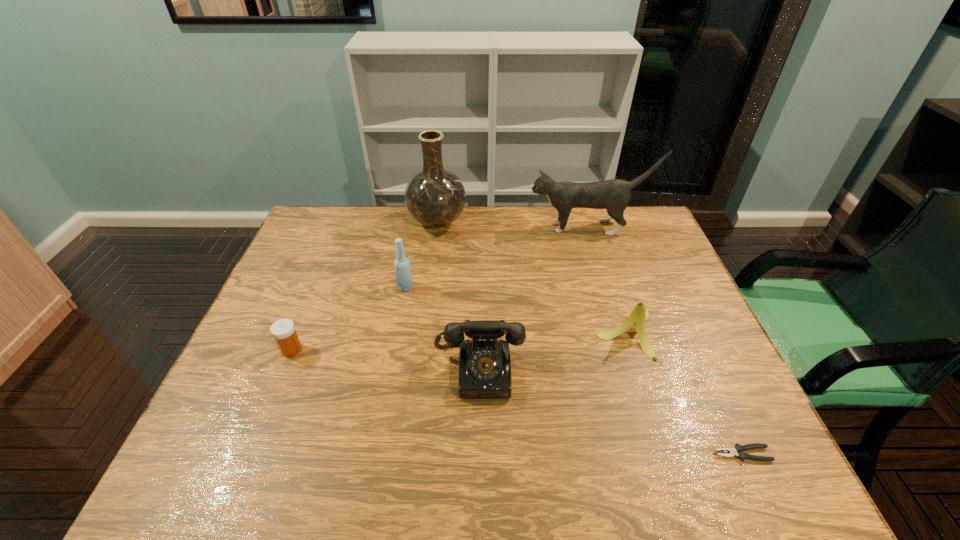
I want to click on vacant space located 0.290m on the right of the vase, so click(x=548, y=222).

Locate an element on the screen. Image resolution: width=960 pixels, height=540 pixels. vacant space located at the face of the cat is located at coordinates (451, 228).

The width and height of the screenshot is (960, 540). I want to click on vacant region located 0.250m at the face of the cat, so click(x=457, y=228).

Locate an element on the screen. This screenshot has width=960, height=540. free point located 0.130m at the face of the cat is located at coordinates (491, 228).

In order to click on free region located 0.080m on the left of the bottle in this screenshot , I will do [371, 287].

At what (x,y) coordinates should I click in order to perform the action: click on vacant position located on the left of the banana. Please return your answer as a coordinate pair (x, y). This screenshot has height=540, width=960. Looking at the image, I should click on (447, 333).

In order to click on free region located on the dial of the telephone in this screenshot , I will do tap(479, 437).

The height and width of the screenshot is (540, 960). In order to click on vacant space located on the left of the leftmost object in this screenshot , I will do `click(254, 349)`.

Locate an element on the screen. vacant space situated at the gripping part of the nearest object is located at coordinates (592, 454).

What are the coordinates of `vacant area located at the gripping part of the nearest object` in the screenshot? It's located at (612, 454).